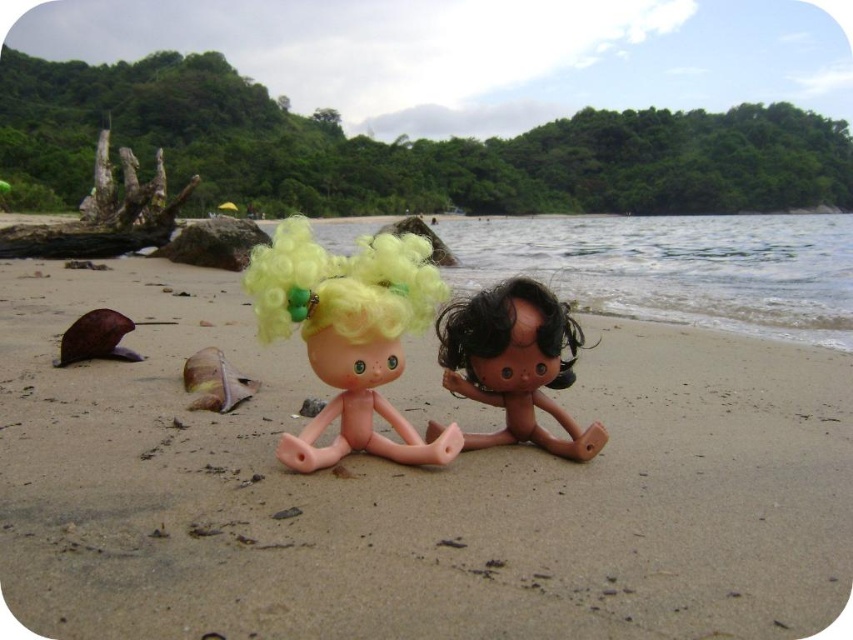
Question: Considering the relative positions of pink plastic doll at center and fluffy yellow hair at center in the image provided, where is pink plastic doll at center located with respect to fluffy yellow hair at center?

Choices:
 (A) above
 (B) below

Answer: (B)

Question: Is pink plastic doll at center further to the viewer compared to matte plastic doll at center?

Choices:
 (A) yes
 (B) no

Answer: (B)

Question: Among these points, which one is nearest to the camera?

Choices:
 (A) (265, 339)
 (B) (339, 292)

Answer: (B)

Question: Which of the following is the closest to the observer?

Choices:
 (A) (381, 304)
 (B) (527, 390)
 (C) (364, 308)
 (D) (241, 561)

Answer: (D)

Question: Which object is closer to the camera taking this photo?

Choices:
 (A) matte plastic doll at center
 (B) fluffy yellow hair at center
 (C) pink plastic doll at center
 (D) smooth beige sand at center

Answer: (D)

Question: Where is smooth beige sand at center located in relation to pink plastic doll at center in the image?

Choices:
 (A) right
 (B) left

Answer: (B)